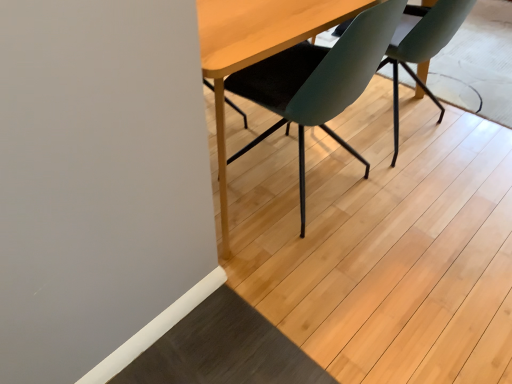
Question: Is matte black chair at center, which is the second chair from right to left, at the right side of teal matte chair at center, the second chair when ordered from left to right?

Choices:
 (A) no
 (B) yes

Answer: (A)

Question: From the image's perspective, is matte black chair at center, which is the first chair in left-to-right order, under teal matte chair at center, which is the 1th chair from right to left?

Choices:
 (A) yes
 (B) no

Answer: (A)

Question: Considering the relative sizes of matte black chair at center, which is the first chair in left-to-right order, and teal matte chair at center, the second chair when ordered from left to right, in the image provided, is matte black chair at center, which is the first chair in left-to-right order, taller than teal matte chair at center, the second chair when ordered from left to right,?

Choices:
 (A) yes
 (B) no

Answer: (A)

Question: Is matte black chair at center, which is the first chair in left-to-right order, next to teal matte chair at center, which is the 1th chair from right to left, and touching it?

Choices:
 (A) no
 (B) yes

Answer: (A)

Question: Is matte black chair at center, which is the second chair from right to left, outside teal matte chair at center, which is the 1th chair from right to left?

Choices:
 (A) yes
 (B) no

Answer: (A)

Question: Can you confirm if matte black chair at center, which is the first chair in left-to-right order, is bigger than teal matte chair at center, which is the 1th chair from right to left?

Choices:
 (A) no
 (B) yes

Answer: (B)

Question: Is teal matte chair at center, which is the 1th chair from right to left, not inside matte black chair at center, which is the second chair from right to left?

Choices:
 (A) yes
 (B) no

Answer: (A)

Question: Is teal matte chair at center, the second chair when ordered from left to right, taller than matte black chair at center, which is the first chair in left-to-right order?

Choices:
 (A) no
 (B) yes

Answer: (A)

Question: Is teal matte chair at center, the second chair when ordered from left to right, oriented away from matte black chair at center, which is the first chair in left-to-right order?

Choices:
 (A) yes
 (B) no

Answer: (B)

Question: Is there a large distance between teal matte chair at center, the second chair when ordered from left to right, and matte black chair at center, which is the second chair from right to left?

Choices:
 (A) yes
 (B) no

Answer: (B)

Question: From a real-world perspective, does teal matte chair at center, which is the 1th chair from right to left, sit lower than matte black chair at center, which is the first chair in left-to-right order?

Choices:
 (A) yes
 (B) no

Answer: (A)

Question: Considering the relative sizes of teal matte chair at center, the second chair when ordered from left to right, and matte black chair at center, which is the first chair in left-to-right order, in the image provided, is teal matte chair at center, the second chair when ordered from left to right, thinner than matte black chair at center, which is the first chair in left-to-right order,?

Choices:
 (A) no
 (B) yes

Answer: (B)

Question: Relative to matte black chair at center, which is the second chair from right to left, is teal matte chair at center, the second chair when ordered from left to right, in front or behind?

Choices:
 (A) front
 (B) behind

Answer: (B)